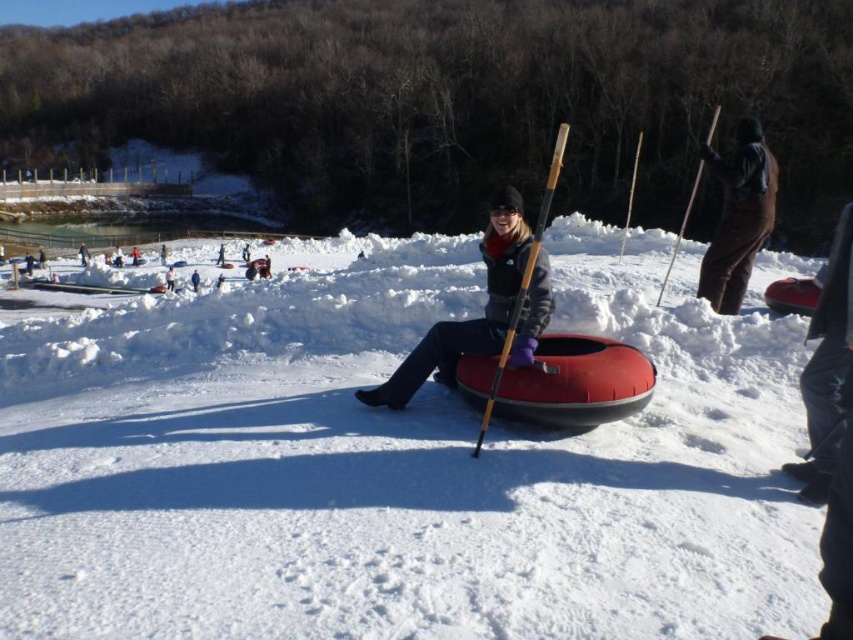
Question: Is white fluffy snow at center wider than red rubber tube at center?

Choices:
 (A) no
 (B) yes

Answer: (B)

Question: Which point is closer to the camera?

Choices:
 (A) matte black jacket at center
 (B) brown fuzzy pants at right
 (C) white snowboard at center

Answer: (A)

Question: Which point appears closest to the camera in this image?

Choices:
 (A) (709, 272)
 (B) (544, 262)

Answer: (B)

Question: From the image, what is the correct spatial relationship of brown fuzzy pants at right in relation to dark gray jacket at center?

Choices:
 (A) below
 (B) above

Answer: (B)

Question: Which object appears farthest from the camera in this image?

Choices:
 (A) white snowboard at center
 (B) dark gray jacket at center
 (C) brown fuzzy pants at right

Answer: (B)

Question: Does white fluffy snow at center have a smaller size compared to dark gray jacket at center?

Choices:
 (A) no
 (B) yes

Answer: (B)